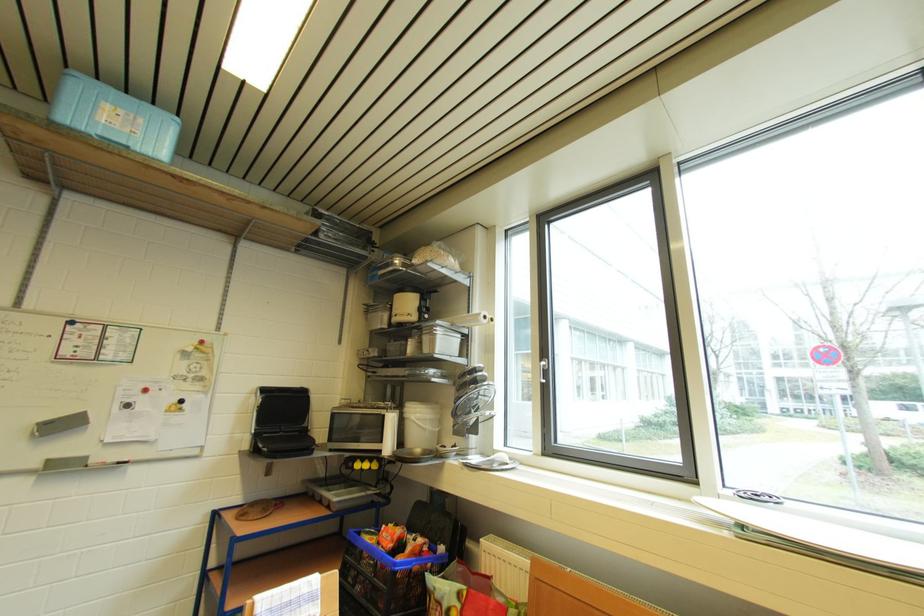
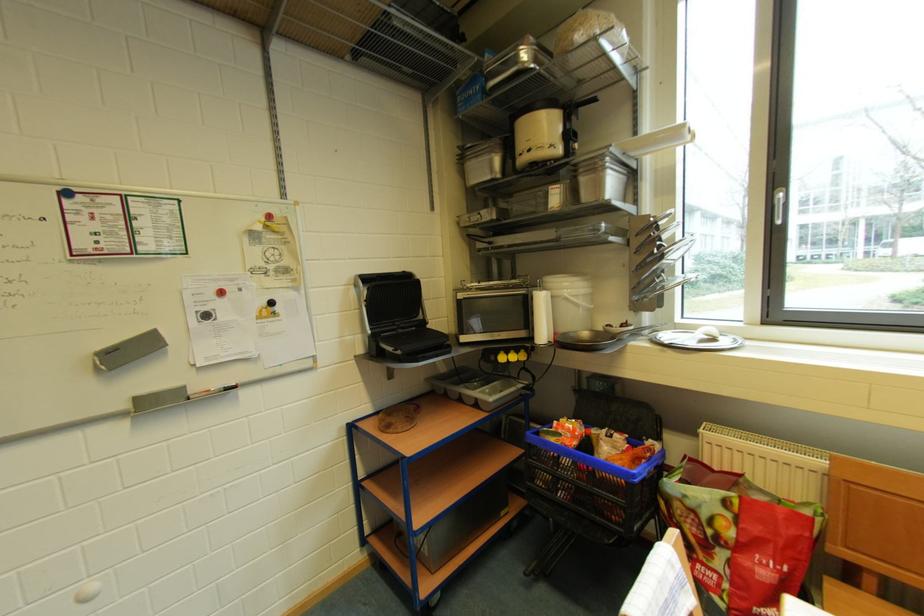
The point at (398,422) is marked in the first image. Where is the corresponding point in the second image?

(548, 302)